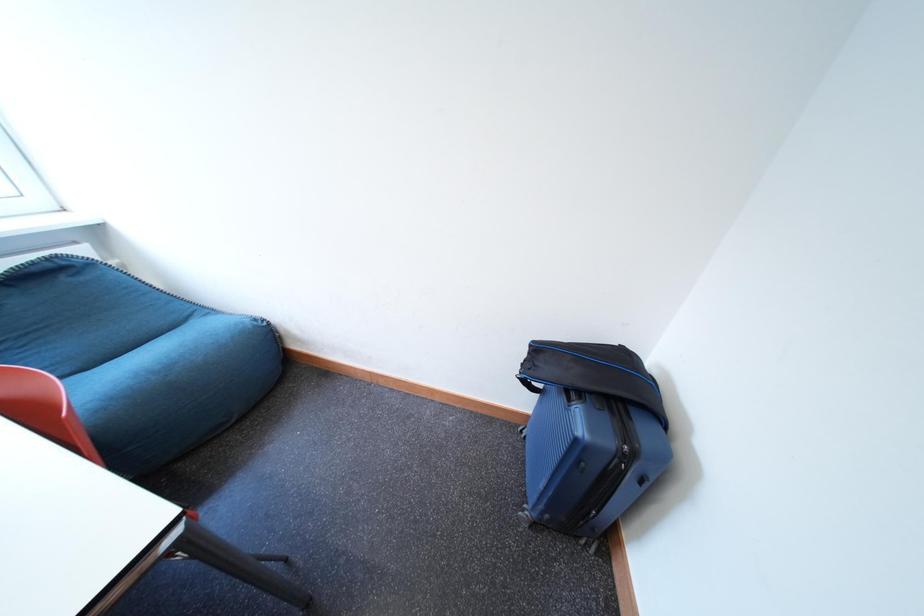
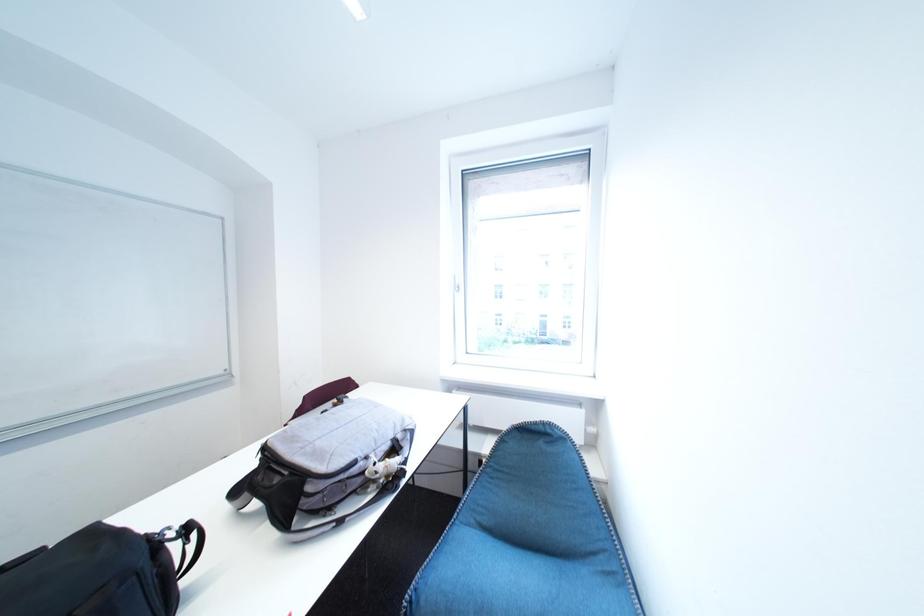
Question: The camera is either moving clockwise (left) or counter-clockwise (right) around the object. The first image is from the beginning of the video and the second image is from the end. Is the camera moving left or right when shooting the video?

Choices:
 (A) Left
 (B) Right

Answer: (B)